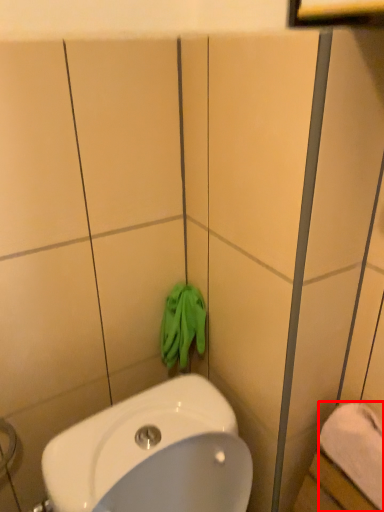
Question: Considering the relative positions of towel/napkin (annotated by the red box) and bath towel in the image provided, where is towel/napkin (annotated by the red box) located with respect to the staircase?

Choices:
 (A) right
 (B) left

Answer: (A)